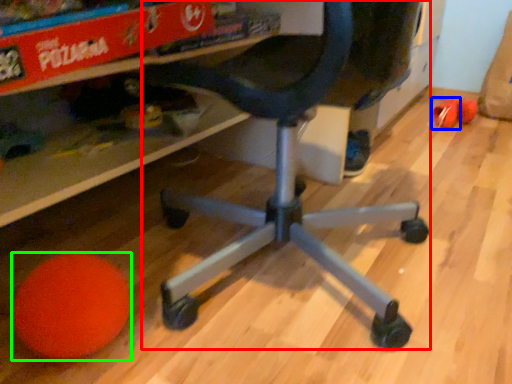
Question: Which object is the farthest from computer chair (highlighted by a red box)? Choose among these: toy (highlighted by a blue box) or ball (highlighted by a green box).

Choices:
 (A) toy
 (B) ball

Answer: (A)